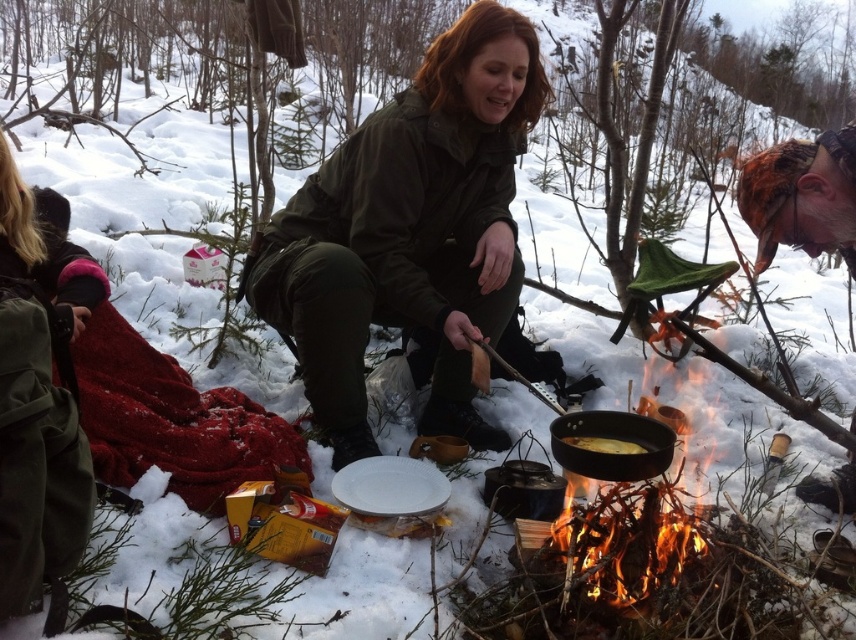
You are a photographer trying to capture the scene of the woman cooking. You want to ensure that both the green matte jacket at center and the golden crispy bread at center are clearly visible in your photo. Based on their positions, which object should you focus on first to ensure both are in frame?

The green matte jacket at center is positioned on the left side of golden crispy bread at center. To ensure both are in frame, focus on the golden crispy bread at center first, as it is centrally located and the jacket is to its left, allowing you to adjust the frame to include both.

You are a photographer trying to capture the shiny black pan at center in your shot. You are currently focused on the green matte jacket at center. Do you need to adjust your camera focus to get the pan in focus?

Yes, because the green matte jacket at center is closer to you than the shiny black pan at center, so you need to adjust the focus to the distance of the shiny black pan at center to get it in focus.

You are a photographer trying to capture the campfire scene. You want to focus on the two points marked in the image. Which point is closer to your camera, point (199, 467) or point (664, 436)?

Point (199, 467) is further to the camera than point (664, 436), so the closer point to your camera is point (664, 436).